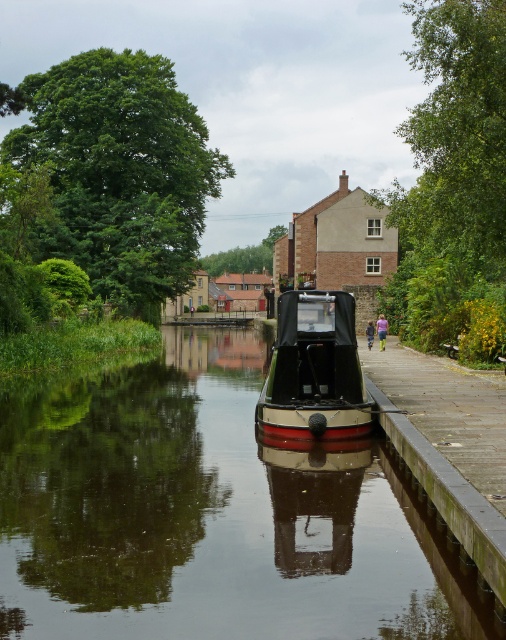
Question: Is smooth black water at center positioned at the back of polished wood boat at center?

Choices:
 (A) no
 (B) yes

Answer: (A)

Question: Considering the relative positions of smooth black water at center and polished wood boat at center in the image provided, where is smooth black water at center located with respect to polished wood boat at center?

Choices:
 (A) above
 (B) below

Answer: (B)

Question: Observing the image, what is the correct spatial positioning of smooth black water at center in reference to polished wood boat at center?

Choices:
 (A) below
 (B) above

Answer: (A)

Question: Which of the following is the farthest from the observer?

Choices:
 (A) (328, 301)
 (B) (162, 326)

Answer: (B)

Question: Which object is closer to the camera taking this photo?

Choices:
 (A) polished wood boat at center
 (B) smooth black water at center

Answer: (B)